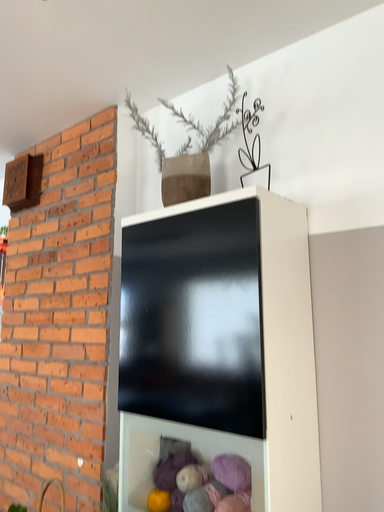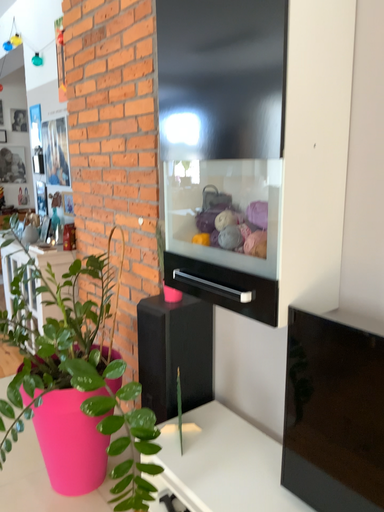
Question: Which way did the camera rotate in the video?

Choices:
 (A) rotated left
 (B) rotated right

Answer: (A)